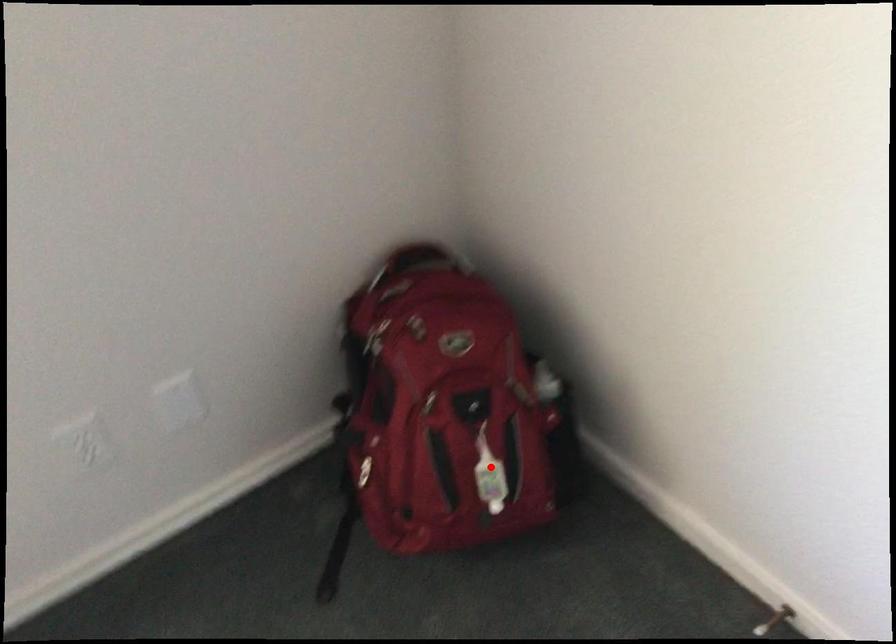
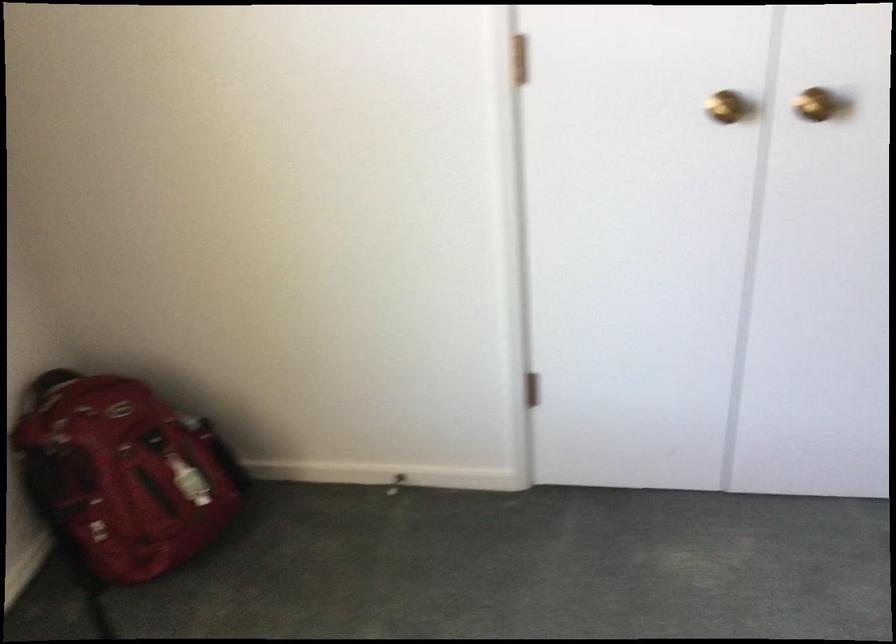
Question: I am providing you with two images of the same scene from different viewpoints. A red point is shown in image1. For the corresponding object point in image2, is it positioned nearer or farther from the camera?

Choices:
 (A) Nearer
 (B) Farther

Answer: (B)